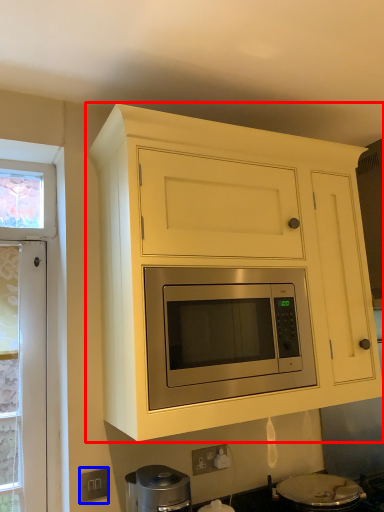
Question: Which object appears farthest to the camera in this image, cabinetry (highlighted by a red box) or electric outlet (highlighted by a blue box)?

Choices:
 (A) cabinetry
 (B) electric outlet

Answer: (B)